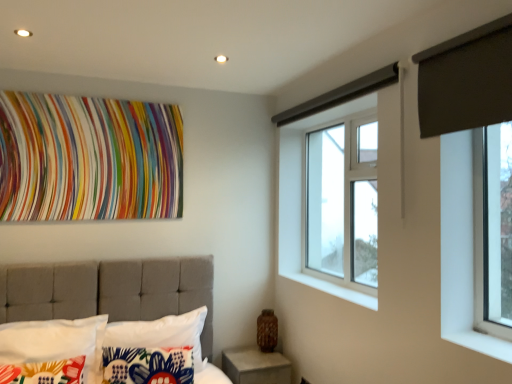
Identify the location of empty space that is ontop of dark gray fabric at upper right. The width and height of the screenshot is (512, 384). (460, 29).